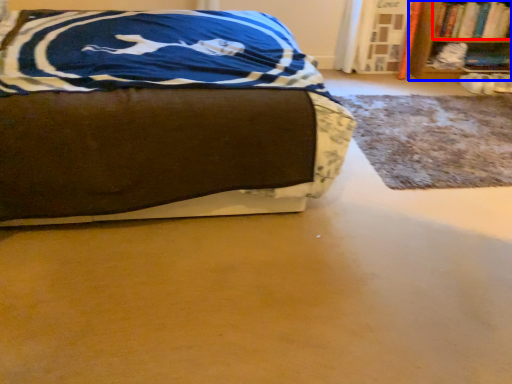
Question: Which point is closer to the camera, book (highlighted by a red box) or bookcase (highlighted by a blue box)?

Choices:
 (A) book
 (B) bookcase

Answer: (B)